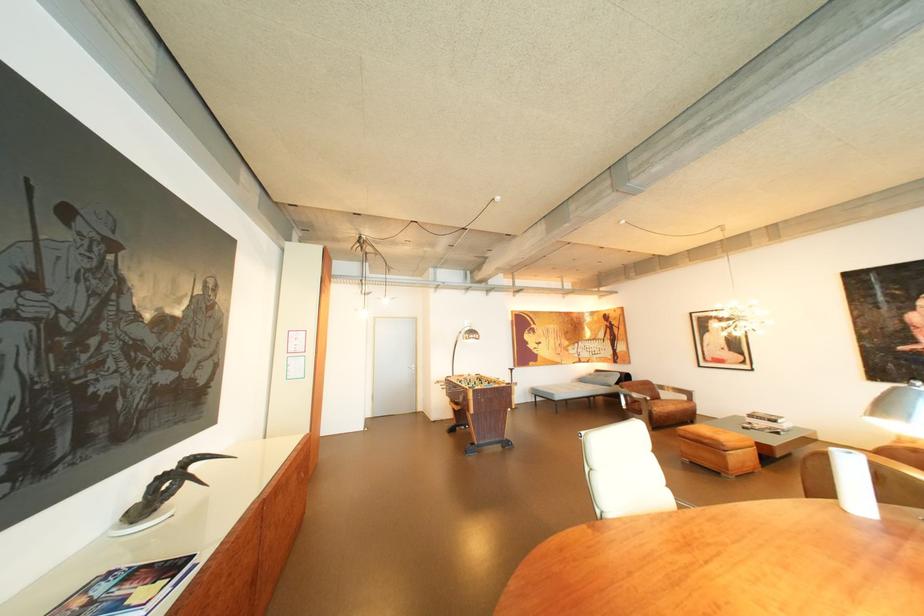
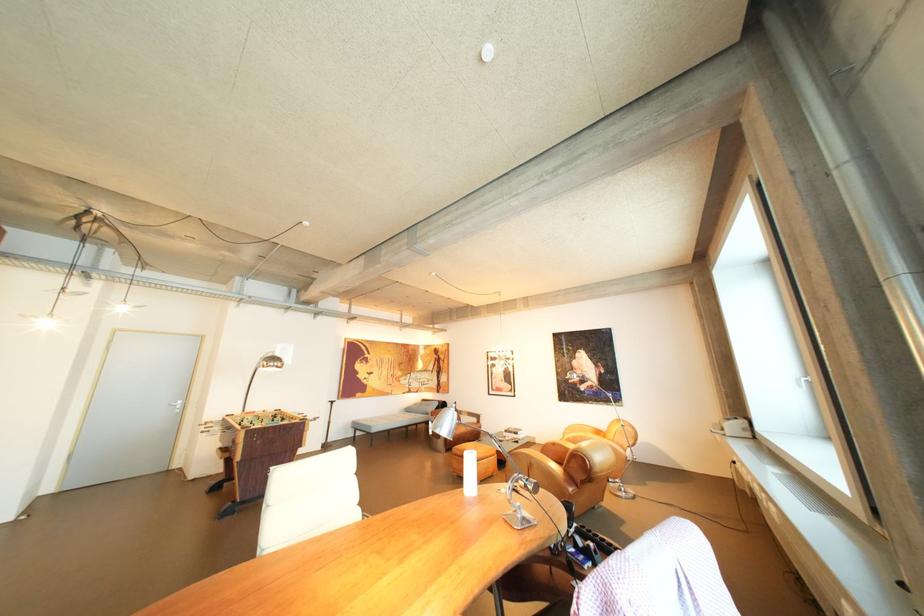
Question: The camera is either moving clockwise (left) or counter-clockwise (right) around the object. The first image is from the beginning of the video and the second image is from the end. Is the camera moving left or right when shooting the video?

Choices:
 (A) Left
 (B) Right

Answer: (A)